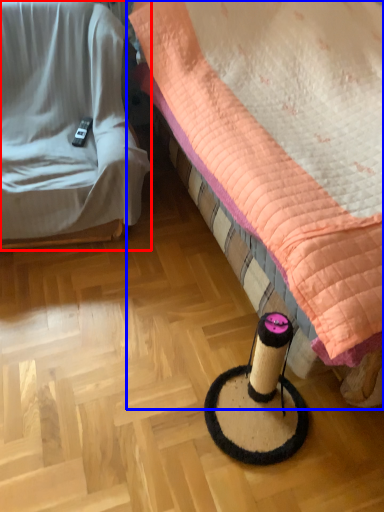
Question: Which point is further to the camera, furniture (highlighted by a red box) or bed (highlighted by a blue box)?

Choices:
 (A) furniture
 (B) bed

Answer: (A)